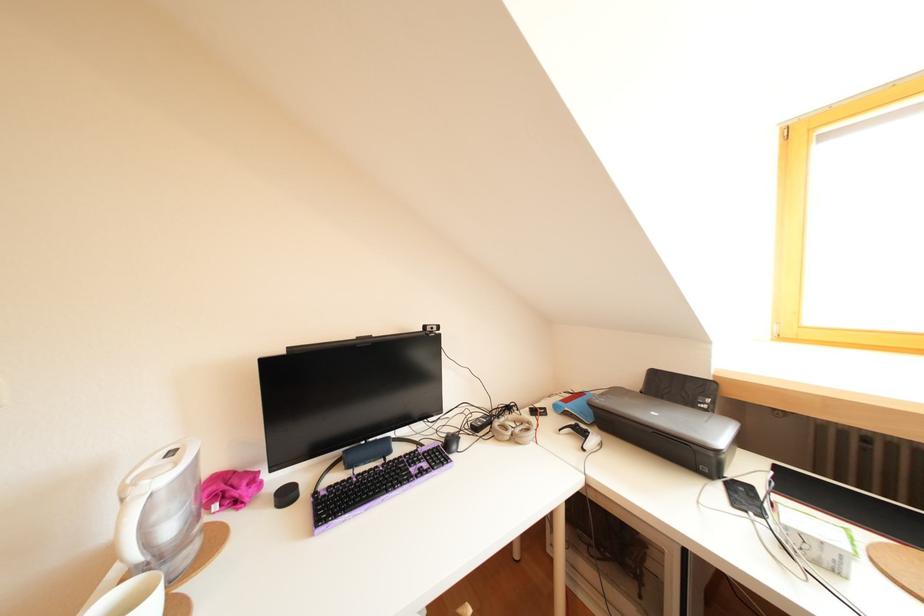
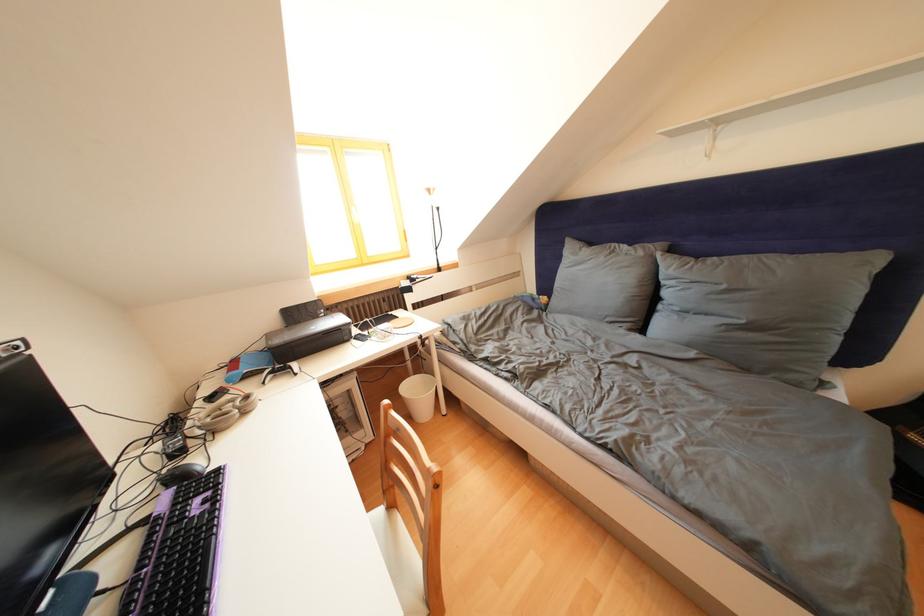
In the second image, find the point that corresponds to (x=542, y=416) in the first image.

(220, 403)